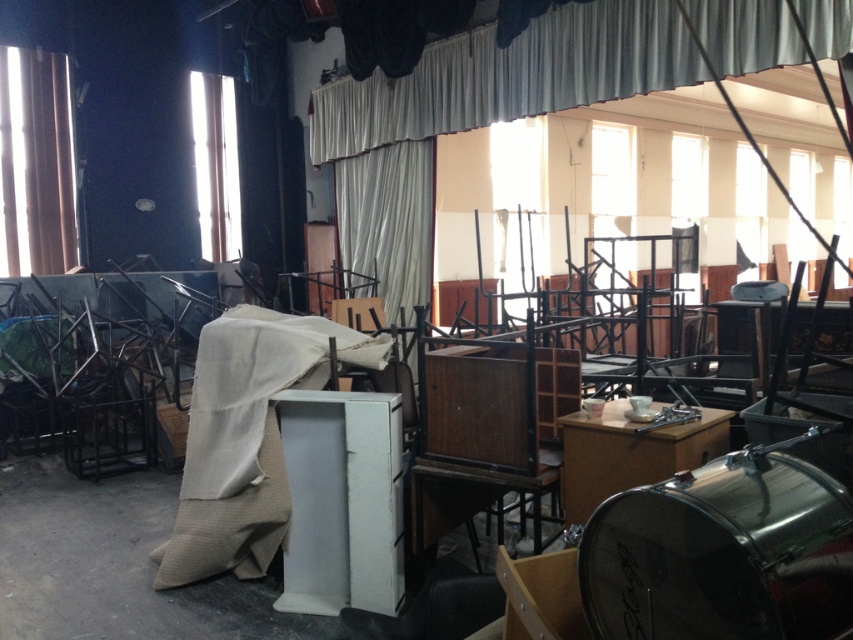
Can you confirm if white fabric curtain at upper center is positioned below wooden cabinet at center?

No.

Is white fabric curtain at upper center above wooden cabinet at center?

Yes, white fabric curtain at upper center is above wooden cabinet at center.

Identify the location of white fabric curtain at upper center. This screenshot has width=853, height=640. (509, 76).

Is wooden cabinet at center wider than brown fabric curtain at left?

Yes.

Can you confirm if wooden cabinet at center is positioned above brown fabric curtain at left?

Incorrect, wooden cabinet at center is not positioned above brown fabric curtain at left.

At what (x,y) coordinates should I click in order to perform the action: click on wooden cabinet at center. Please return your answer as a coordinate pair (x, y). This screenshot has height=640, width=853. Looking at the image, I should click on (488, 432).

Image resolution: width=853 pixels, height=640 pixels. Describe the element at coordinates (509, 76) in the screenshot. I see `white fabric curtain at upper center` at that location.

Which of these two, white fabric curtain at upper center or brown fabric curtain at left, stands taller?

brown fabric curtain at left is taller.

Where is `white fabric curtain at upper center`? white fabric curtain at upper center is located at coordinates (509, 76).